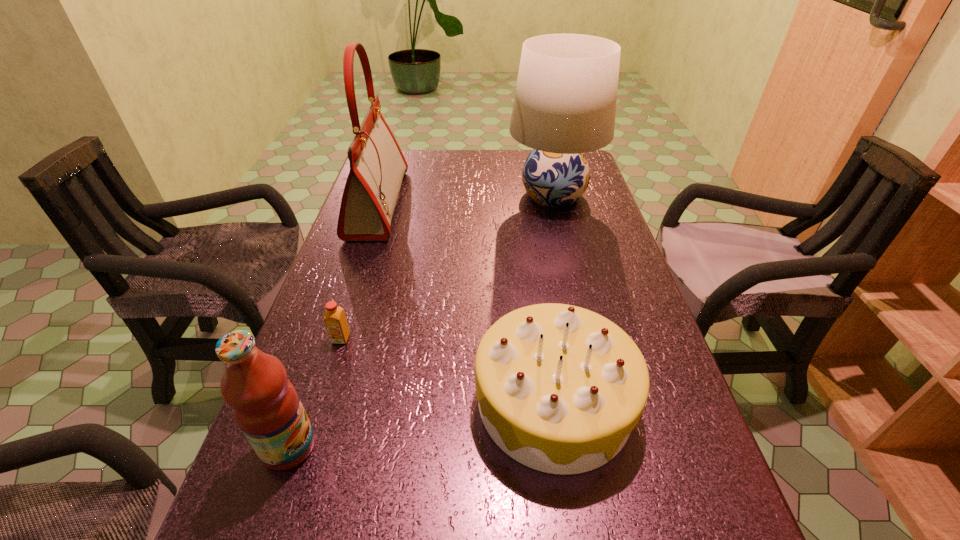
Identify the location of vacant space positioned 0.360m on the back of the second shortest object. (531, 241).

Image resolution: width=960 pixels, height=540 pixels. I want to click on free space located on the front and back of the orange juice, so click(x=308, y=443).

The image size is (960, 540). What are the coordinates of `handbag that is at the far edge` in the screenshot? It's located at (377, 165).

Locate an element on the screen. lampshade that is at the far edge is located at coordinates (565, 101).

Where is `handbag at the left edge`? handbag at the left edge is located at coordinates (377, 165).

Image resolution: width=960 pixels, height=540 pixels. Identify the location of fruit juice positioned at the left edge. (265, 404).

Locate an element on the screen. orange juice located in the left edge section of the desktop is located at coordinates (335, 320).

Image resolution: width=960 pixels, height=540 pixels. What are the coordinates of `lampshade that is at the right edge` in the screenshot? It's located at (565, 101).

Locate an element on the screen. The width and height of the screenshot is (960, 540). birthday cake present at the right edge is located at coordinates click(560, 388).

Identify the location of object that is at the far left corner. click(x=377, y=165).